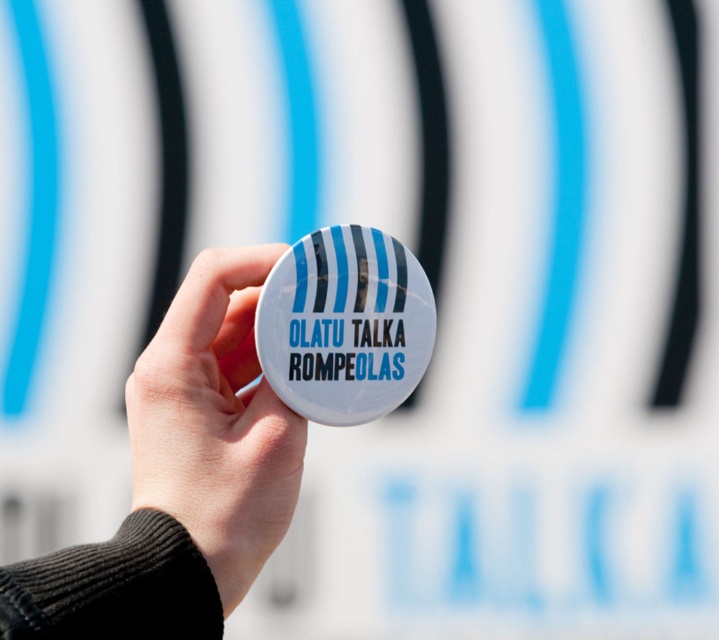
Question: Which of the following is the closest to the observer?

Choices:
 (A) white glossy button at center
 (B) white matte button at center

Answer: (B)

Question: Which of the following is the closest to the observer?

Choices:
 (A) white matte button at center
 (B) white glossy button at center

Answer: (A)

Question: Does white matte button at center come behind white glossy button at center?

Choices:
 (A) no
 (B) yes

Answer: (A)

Question: Is white matte button at center smaller than white glossy button at center?

Choices:
 (A) no
 (B) yes

Answer: (A)

Question: Is white matte button at center thinner than white glossy button at center?

Choices:
 (A) yes
 (B) no

Answer: (B)